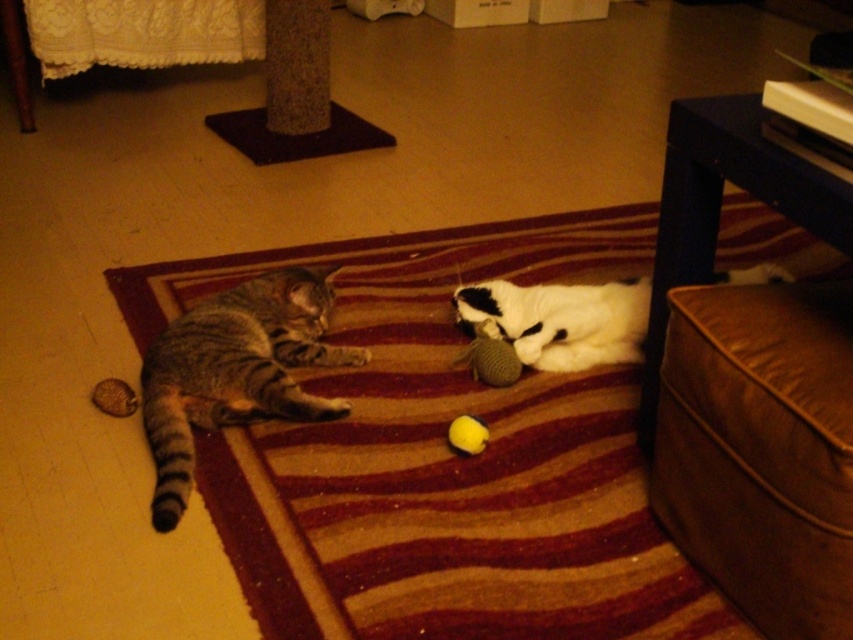
You are a cat owner who wants to place a new cat tree in the room. You have a cat tree that is 1.2 meters wide. The current space between the brown leather ottoman at lower right and the white soft plush at center is 1.5 meters. Is there enough space to fit the cat tree between them?

The space between the brown leather ottoman at lower right and the white soft plush at center is 1.5 meters, which is wider than the cat tree that is 1.2 meters wide. Therefore, there is enough space to fit the cat tree between them.

In the scene shown: You are a cat owner who wants to place a new cat bed in the room. The bed requires a clear space of 0.5 meters by 0.5 meters. Given the coordinates of the striped carpet at center, can you determine if there is enough space there to place the bed?

The striped carpet at center is located at coordinates point (x=444, y=458). Since the carpet itself is the primary surface in the scene and the cats are already positioned on it, there may not be a clear 0.5m x 0.5m space available. Check the current layout to ensure no cats or objects occupy that area before placing the bed.